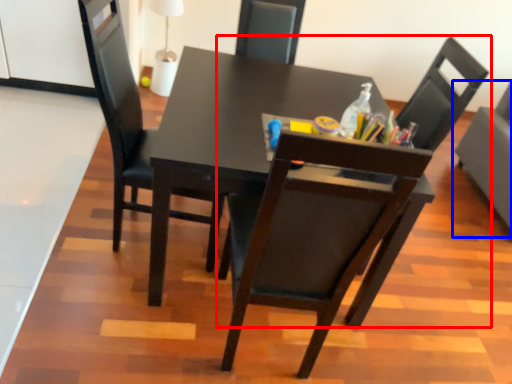
Question: Which object appears farthest to the camera in this image, chair (highlighted by a red box) or chair (highlighted by a blue box)?

Choices:
 (A) chair
 (B) chair

Answer: (B)